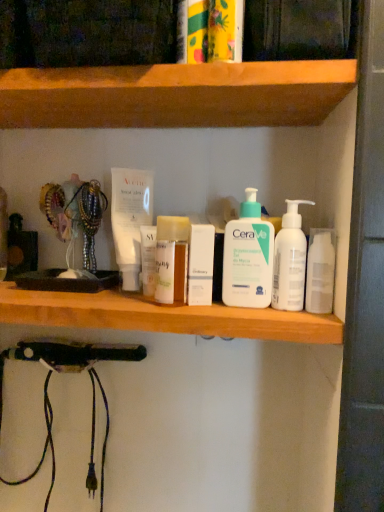
Question: From the image's perspective, is white matte pump bottle at center, which is the second cleaning product from right to left, above or below white glossy mouthwash at right?

Choices:
 (A) above
 (B) below

Answer: (A)

Question: Considering their positions, is white matte pump bottle at center, which is the second cleaning product from right to left, located in front of or behind white glossy mouthwash at right?

Choices:
 (A) front
 (B) behind

Answer: (B)

Question: Based on their relative distances, which object is farther from the white matte pump bottle at center, which is the second cleaning product from right to left?

Choices:
 (A) white plastic bottles at center, arranged as the second shelf when viewed from the top
 (B) white matte box at center
 (C) white glossy mouthwash at right
 (D) wooden at upper center, the second shelf in the bottom-to-top sequence
 (E) white pump bottle at center, which is the first cleaning product in right-to-left order

Answer: (D)

Question: Based on their relative distances, which object is farther from the white matte pump bottle at center, which is the 1th cleaning product in left-to-right order?

Choices:
 (A) white plastic bottles at center, marked as the 1th shelf in a bottom-to-top arrangement
 (B) white matte box at center
 (C) white glossy mouthwash at right
 (D) white pump bottle at center, which is the first cleaning product in right-to-left order
 (E) wooden at upper center, the second shelf in the bottom-to-top sequence

Answer: (E)